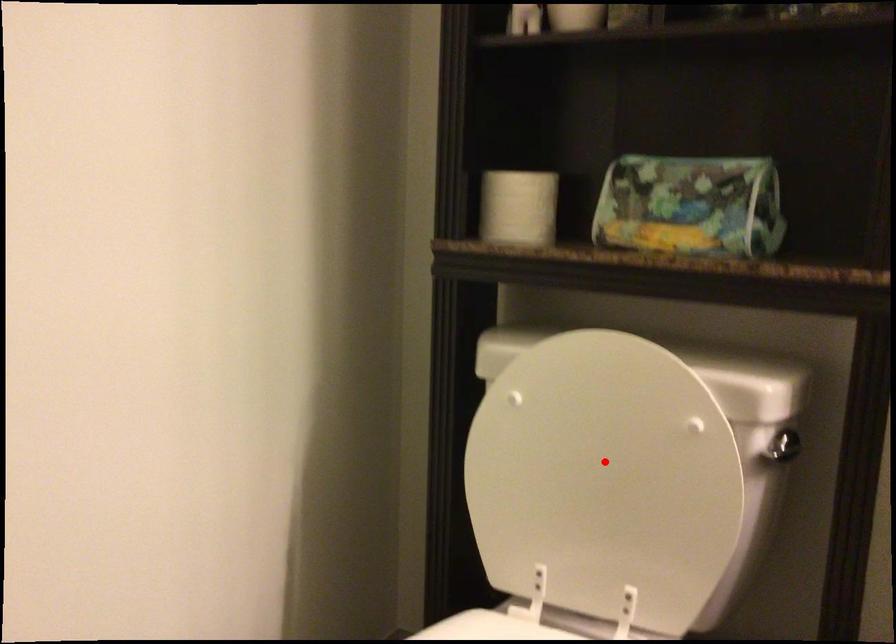
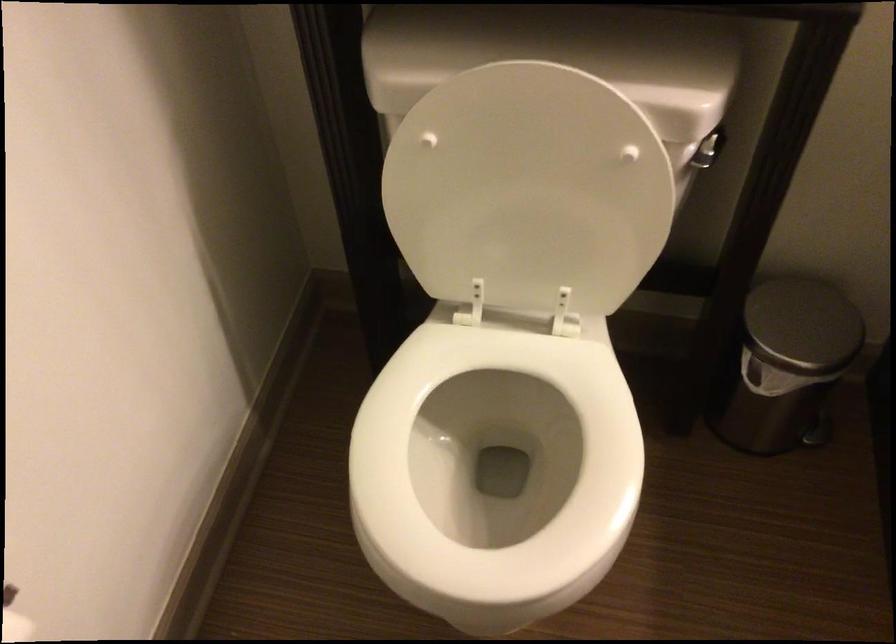
Locate, in the second image, the point that corresponds to the highlighted location in the first image.

(528, 189)